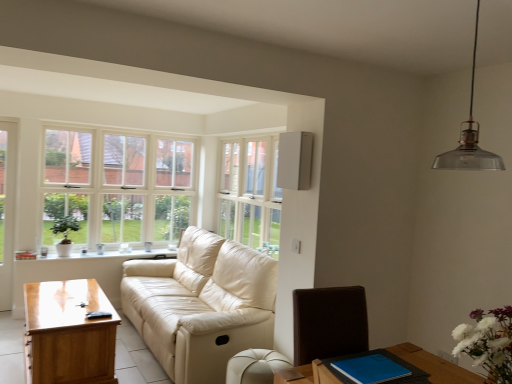
Question: Is white wooden window at upper left, the 2th window positioned from the right, not close to white matte flowers at lower right?

Choices:
 (A) no
 (B) yes

Answer: (B)

Question: Is white matte flowers at lower right at the back of white wooden window at upper left, the 2th window positioned from the right?

Choices:
 (A) yes
 (B) no

Answer: (B)

Question: Considering the relative positions of white wooden window at upper left, the 1th window when ordered from left to right, and white matte flowers at lower right in the image provided, is white wooden window at upper left, the 1th window when ordered from left to right, to the right of white matte flowers at lower right from the viewer's perspective?

Choices:
 (A) no
 (B) yes

Answer: (A)

Question: Is white matte flowers at lower right surrounded by white wooden window at upper left, the 2th window positioned from the right?

Choices:
 (A) yes
 (B) no

Answer: (B)

Question: Considering the relative sizes of white wooden window at upper left, the 1th window when ordered from left to right, and white matte flowers at lower right in the image provided, is white wooden window at upper left, the 1th window when ordered from left to right, smaller than white matte flowers at lower right?

Choices:
 (A) no
 (B) yes

Answer: (A)

Question: Considering the relative positions of transparent glass pendant lamp at upper right and white leather ottoman at lower center in the image provided, is transparent glass pendant lamp at upper right to the left or to the right of white leather ottoman at lower center?

Choices:
 (A) left
 (B) right

Answer: (B)

Question: Is transparent glass pendant lamp at upper right situated inside white leather ottoman at lower center or outside?

Choices:
 (A) outside
 (B) inside

Answer: (A)

Question: Looking at the image, does transparent glass pendant lamp at upper right seem bigger or smaller compared to white leather ottoman at lower center?

Choices:
 (A) small
 (B) big

Answer: (A)

Question: From the image's perspective, is transparent glass pendant lamp at upper right above or below white leather ottoman at lower center?

Choices:
 (A) below
 (B) above

Answer: (B)

Question: From a real-world perspective, is white glass screen door at left positioned above or below white ceramic window sill at lower left?

Choices:
 (A) below
 (B) above

Answer: (B)

Question: From the image's perspective, is white glass screen door at left above or below white ceramic window sill at lower left?

Choices:
 (A) above
 (B) below

Answer: (A)

Question: Would you say white glass screen door at left is to the left or to the right of white ceramic window sill at lower left in the picture?

Choices:
 (A) left
 (B) right

Answer: (A)

Question: From their relative heights in the image, would you say white glass screen door at left is taller or shorter than white ceramic window sill at lower left?

Choices:
 (A) tall
 (B) short

Answer: (A)

Question: Is white ceramic window sill at lower left spatially inside transparent glass pendant lamp at upper right, or outside of it?

Choices:
 (A) outside
 (B) inside

Answer: (A)

Question: From a real-world perspective, is white ceramic window sill at lower left physically located above or below transparent glass pendant lamp at upper right?

Choices:
 (A) below
 (B) above

Answer: (A)